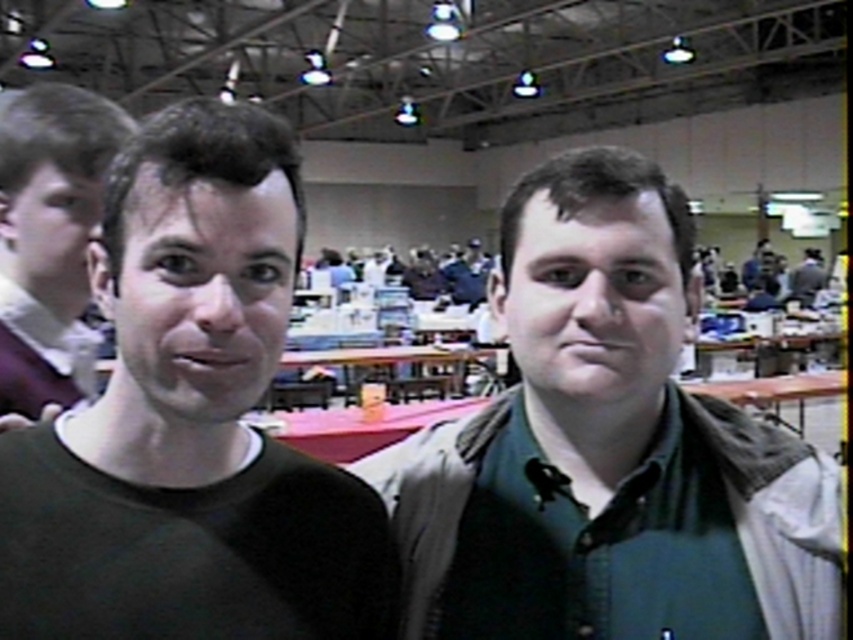
Does matte black face at left appear over smooth skin face at upper left?

No, matte black face at left is not above smooth skin face at upper left.

Between point (260, 262) and point (35, 272), which one is positioned behind?

Positioned behind is point (35, 272).

The height and width of the screenshot is (640, 853). I want to click on matte black face at left, so click(200, 294).

Is green matte jacket at center below matte black shirt at left?

Yes.

Is point (410, 595) positioned behind point (45, 150)?

No.

The image size is (853, 640). I want to click on green matte jacket at center, so click(607, 449).

Can you confirm if green matte face at center is thinner than matte black shirt at left?

Incorrect, green matte face at center's width is not less than matte black shirt at left's.

Measure the distance between green matte face at center and matte black shirt at left.

green matte face at center and matte black shirt at left are 72.51 centimeters apart from each other.

Locate an element on the screen. This screenshot has height=640, width=853. green matte face at center is located at coordinates click(593, 300).